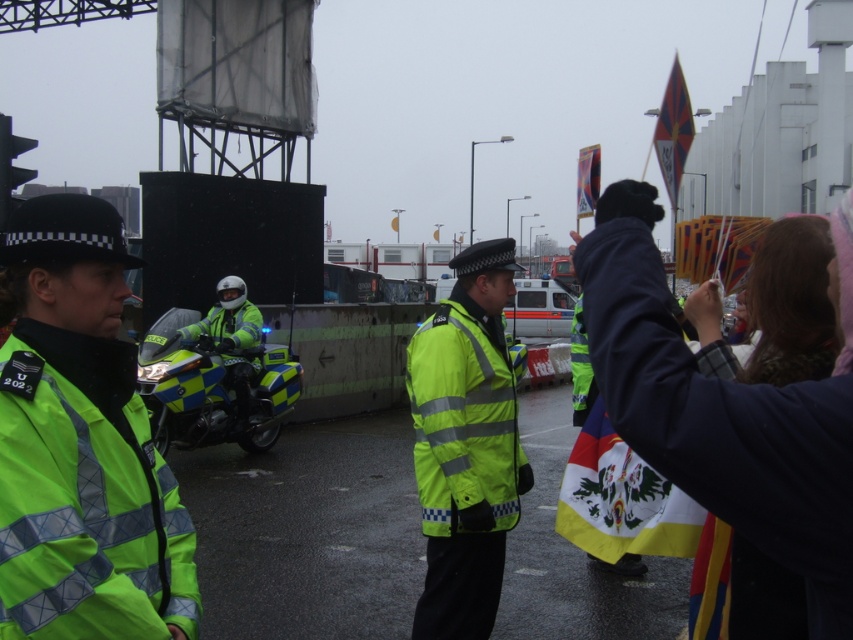
Based on the photo, how much distance is there between neon yellow reflective jacket at left and dark blue fabric at upper right?

The distance of neon yellow reflective jacket at left from dark blue fabric at upper right is 1.20 meters.

Between point (53, 202) and point (757, 440), which one is positioned behind?

The point (53, 202) is behind.

I want to click on neon yellow reflective jacket at left, so click(80, 444).

Which is more to the left, neon yellow reflective jacket at left or neon yellow reflective jacket at center?

neon yellow reflective jacket at center is more to the left.

You are a GUI agent. You are given a task and a screenshot of the screen. Output one action in this format:
    pyautogui.click(x=<x>, y=<y>)
    Task: Click on the neon yellow reflective jacket at left
    Image resolution: width=853 pixels, height=640 pixels.
    Given the screenshot: What is the action you would take?
    pyautogui.click(x=80, y=444)

Is point (41, 221) closer to viewer compared to point (247, 408)?

Yes, point (41, 221) is in front of point (247, 408).

You are a GUI agent. You are given a task and a screenshot of the screen. Output one action in this format:
    pyautogui.click(x=<x>, y=<y>)
    Task: Click on the neon yellow reflective jacket at left
    Image resolution: width=853 pixels, height=640 pixels.
    Given the screenshot: What is the action you would take?
    pyautogui.click(x=80, y=444)

Is neon yellow reflective jacket at left positioned behind yellow fabric flag at upper center?

No, it is not.

Does neon yellow reflective jacket at left have a larger size compared to yellow fabric flag at upper center?

Incorrect, neon yellow reflective jacket at left is not larger than yellow fabric flag at upper center.

The height and width of the screenshot is (640, 853). I want to click on neon yellow reflective jacket at left, so click(x=80, y=444).